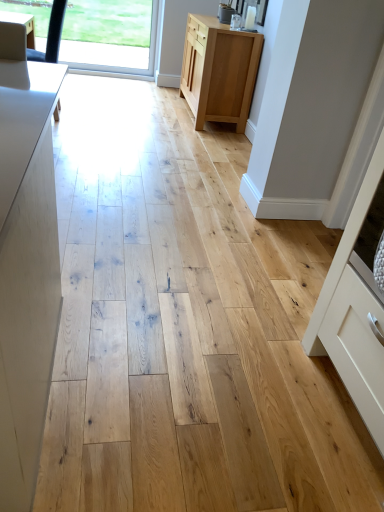
Question: Considering the relative positions of white matte cabinet at right, the 2th cabinetry when ordered from top to bottom, and transparent glass window at upper left in the image provided, is white matte cabinet at right, the 2th cabinetry when ordered from top to bottom, in front of transparent glass window at upper left?

Choices:
 (A) no
 (B) yes

Answer: (B)

Question: From the image's perspective, is white matte cabinet at right, the first cabinetry positioned from the front, beneath transparent glass window at upper left?

Choices:
 (A) yes
 (B) no

Answer: (A)

Question: Can you confirm if white matte cabinet at right, the 1th cabinetry positioned from the right, is thinner than transparent glass window at upper left?

Choices:
 (A) no
 (B) yes

Answer: (A)

Question: From a real-world perspective, is white matte cabinet at right, the 1th cabinetry positioned from the right, beneath transparent glass window at upper left?

Choices:
 (A) no
 (B) yes

Answer: (A)

Question: Can we say white matte cabinet at right, which ranks as the first cabinetry in bottom-to-top order, lies outside transparent glass window at upper left?

Choices:
 (A) yes
 (B) no

Answer: (A)

Question: Is white matte cabinet at right, which ranks as the first cabinetry in bottom-to-top order, at the left side of transparent glass window at upper left?

Choices:
 (A) no
 (B) yes

Answer: (A)

Question: Considering the relative sizes of transparent glass window at upper left and natural wood cabinet at center, marked as the first cabinetry in a back-to-front arrangement, in the image provided, is transparent glass window at upper left shorter than natural wood cabinet at center, marked as the first cabinetry in a back-to-front arrangement,?

Choices:
 (A) no
 (B) yes

Answer: (A)

Question: Can you confirm if transparent glass window at upper left is bigger than natural wood cabinet at center, which appears as the second cabinetry when ordered from the bottom?

Choices:
 (A) no
 (B) yes

Answer: (A)

Question: Is transparent glass window at upper left not near natural wood cabinet at center, which is counted as the second cabinetry, starting from the front?

Choices:
 (A) yes
 (B) no

Answer: (A)

Question: Is transparent glass window at upper left aimed at natural wood cabinet at center, which is the first cabinetry from top to bottom?

Choices:
 (A) no
 (B) yes

Answer: (B)

Question: Is transparent glass window at upper left oriented away from natural wood cabinet at center, positioned as the first cabinetry in left-to-right order?

Choices:
 (A) no
 (B) yes

Answer: (A)

Question: Can natural wood cabinet at center, marked as the first cabinetry in a back-to-front arrangement, be found inside transparent glass window at upper left?

Choices:
 (A) yes
 (B) no

Answer: (B)

Question: Is natural wood cabinet at center, which appears as the second cabinetry when ordered from the bottom, at the right side of white matte cabinet at right, the 2th cabinetry when ordered from top to bottom?

Choices:
 (A) no
 (B) yes

Answer: (A)